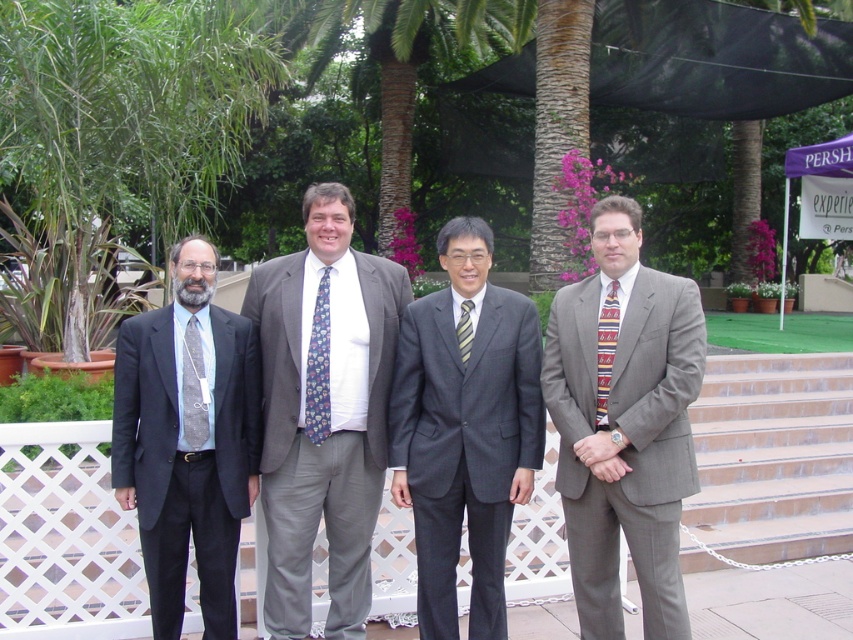
You are a photographer trying to capture a group photo of the four men standing in front of the white lattice fence at center and the blue floral tie at center. Since you want to ensure both the background and the details of the ties are visible, which object should you focus on first to get a clear shot?

You should focus on the white lattice fence at center first because its width is larger than the blue floral tie at center, making it easier to capture the background details clearly before adjusting for the smaller details of the tie.

You are standing in front of the white lattice fence where the four men are posing. You need to take a photo that includes both the point at (x=750, y=468) and the point at (x=326, y=316). Which point should be closer to the camera to ensure both are in focus?

To ensure both points are in focus, the point at (x=326, y=316) should be closer to the camera since it is in front of the point at (x=750, y=468). This way, the depth of field will cover both positions effectively.

You are a photographer trying to capture a closeup of the gray textured suit at center in the image. The camera focus point is currently at point (624,422). Will this point be sufficient to focus on the gray textured suit at center?

Yes, the point (624,422) is on the gray textured suit at center, so it will be sufficient to focus on it.